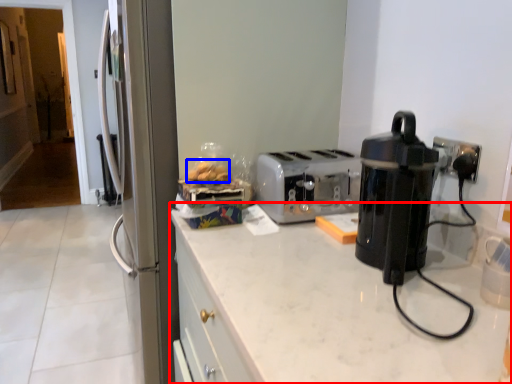
Question: Which point is closer to the camera, countertop (highlighted by a red box) or food (highlighted by a blue box)?

Choices:
 (A) countertop
 (B) food

Answer: (A)